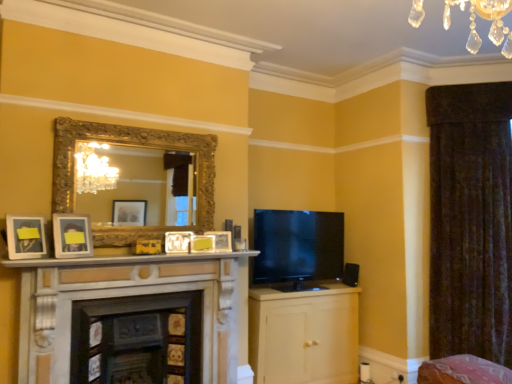
This screenshot has height=384, width=512. What are the coordinates of `free point above gold ornate mirror at upper center (from a real-world perspective)` in the screenshot? It's located at (144, 120).